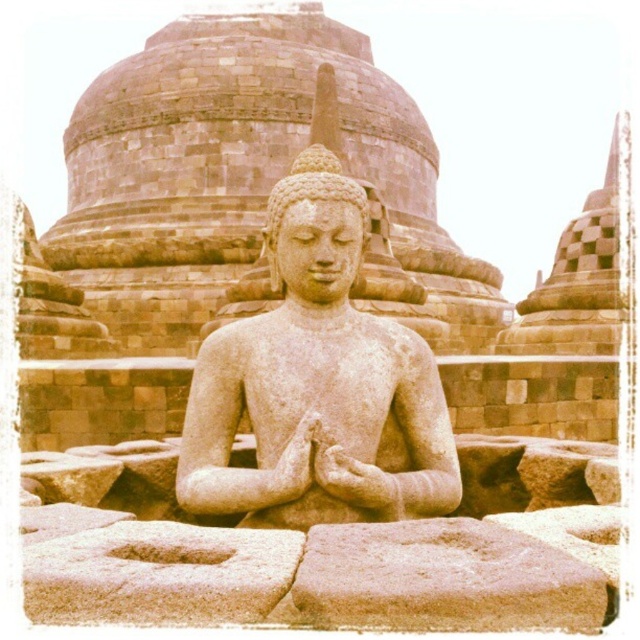
Question: Which object appears closest to the camera in this image?

Choices:
 (A) smooth stone statue at center
 (B) smooth sandstone at center

Answer: (B)

Question: Among these objects, which one is farthest from the camera?

Choices:
 (A) smooth sandstone at center
 (B) smooth stone statue at center

Answer: (B)

Question: Considering the relative positions of smooth stone statue at center and smooth sandstone at center in the image provided, where is smooth stone statue at center located with respect to smooth sandstone at center?

Choices:
 (A) above
 (B) below

Answer: (A)

Question: Is smooth stone statue at center to the right of smooth sandstone at center from the viewer's perspective?

Choices:
 (A) yes
 (B) no

Answer: (B)

Question: Is smooth stone statue at center in front of smooth sandstone at center?

Choices:
 (A) no
 (B) yes

Answer: (A)